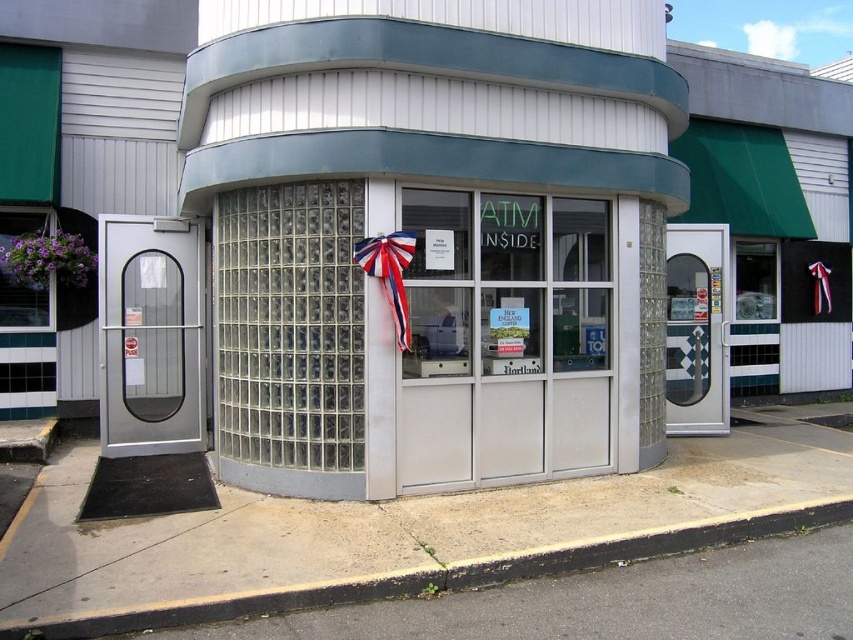
You are a delivery person who needs to place a small package on the clear glass atm at center without blocking the red fabric bow at center. Can you do this?

The clear glass atm at center is taller than the red fabric bow at center, so placing the package on top of the clear glass atm at center would not interfere with the red fabric bow at center.

You are standing at the corner of two streets and see the retro teal and white ATM kiosk with a patriotic ribbon. There is a point marked at coordinates (434, 236). What object does this point correspond to?

The point corresponds to the clear glass atm at center.